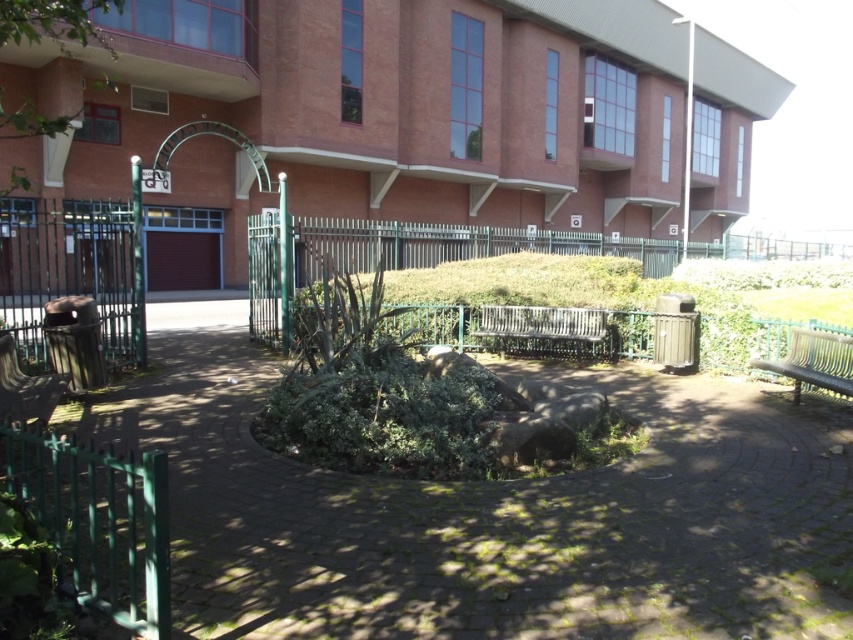
Question: Considering the relative positions of green metal bench at right and metallic silver bench at center in the image provided, where is green metal bench at right located with respect to metallic silver bench at center?

Choices:
 (A) below
 (B) above

Answer: (A)

Question: Which object is positioned closest to the metallic silver bench at center?

Choices:
 (A) green metal bench at right
 (B) green cobblestone path at center

Answer: (A)

Question: Can you confirm if green metal bench at right is positioned above metallic silver bench at center?

Choices:
 (A) no
 (B) yes

Answer: (A)

Question: Does green cobblestone path at center appear under green metal bench at right?

Choices:
 (A) no
 (B) yes

Answer: (B)

Question: Which point is closer to the camera taking this photo?

Choices:
 (A) (844, 369)
 (B) (503, 314)
 (C) (740, 445)

Answer: (C)

Question: Which object appears farthest from the camera in this image?

Choices:
 (A) green metal bench at right
 (B) green cobblestone path at center
 (C) metallic silver bench at center

Answer: (C)